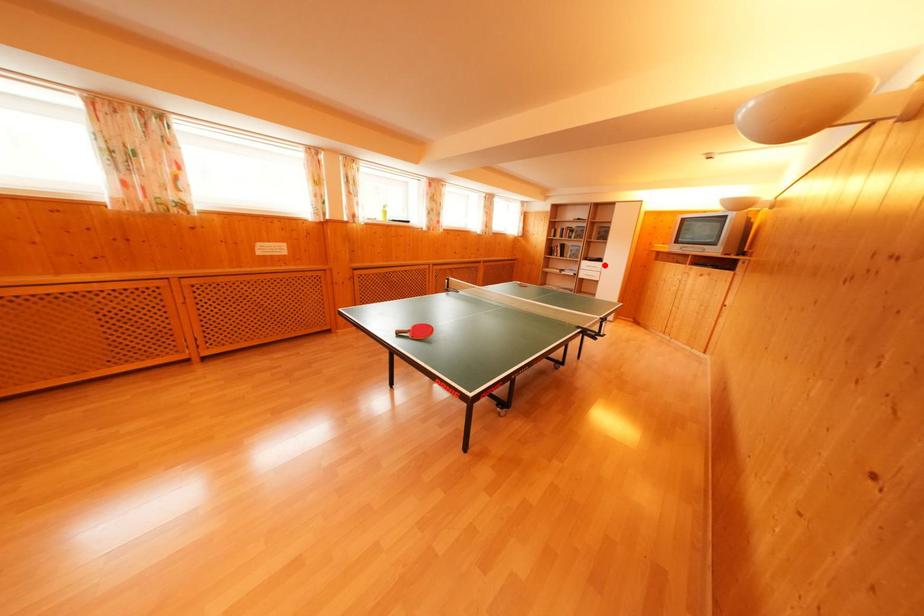
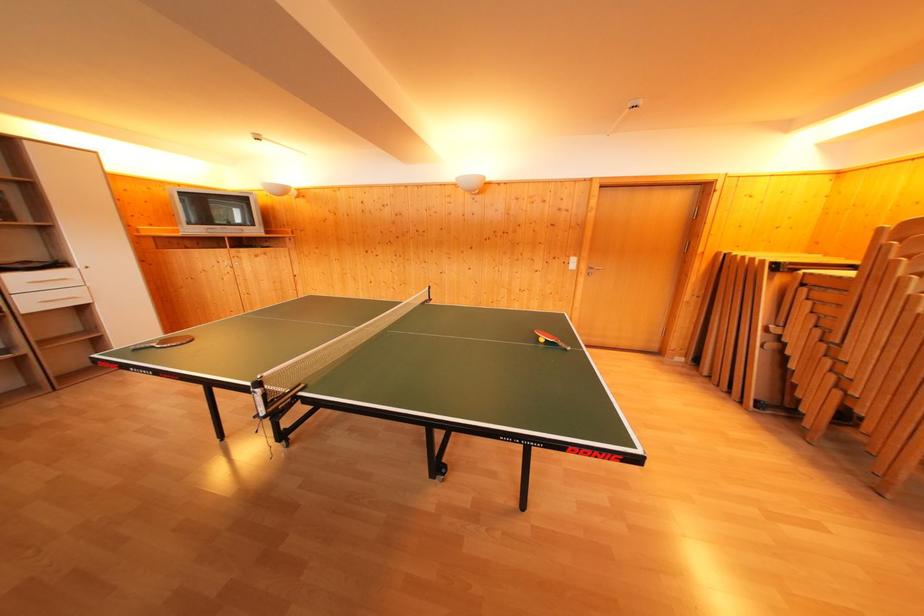
Locate, in the second image, the point that corresponds to the highlighted location in the first image.

(64, 270)